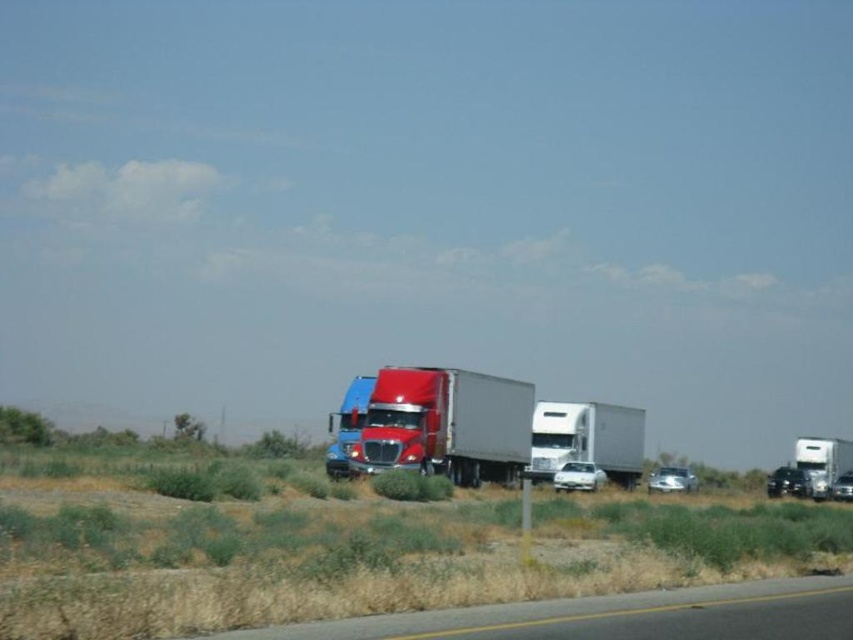
Question: Which point is closer to the camera?

Choices:
 (A) gray asphalt road at lower center
 (B) white matte trailer truck at center
 (C) metallic silver trailer truck at center

Answer: (A)

Question: Which of these objects is positioned closest to the gray asphalt road at lower center?

Choices:
 (A) metallic silver trailer truck at center
 (B) white matte trailer truck at center

Answer: (A)

Question: Observing the image, what is the correct spatial positioning of gray asphalt road at lower center in reference to white matte trailer truck at center?

Choices:
 (A) left
 (B) right

Answer: (A)

Question: Does metallic silver trailer truck at center lie behind white matte trailer truck at center?

Choices:
 (A) yes
 (B) no

Answer: (B)

Question: Which point is closer to the camera taking this photo?

Choices:
 (A) (323, 636)
 (B) (492, 449)
 (C) (619, 422)

Answer: (A)

Question: Where is metallic silver trailer truck at center located in relation to white matte trailer truck at center in the image?

Choices:
 (A) right
 (B) left

Answer: (B)